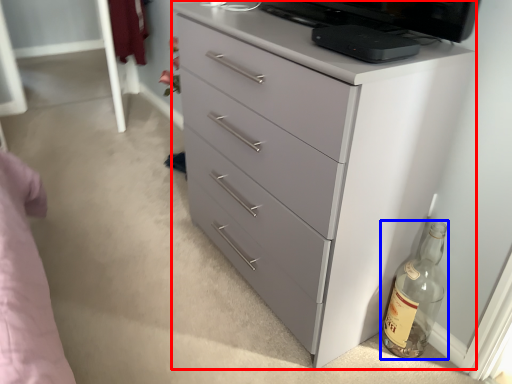
Question: Which of the following is the farthest to the observer, chest of drawers (highlighted by a red box) or bottle (highlighted by a blue box)?

Choices:
 (A) chest of drawers
 (B) bottle

Answer: (B)